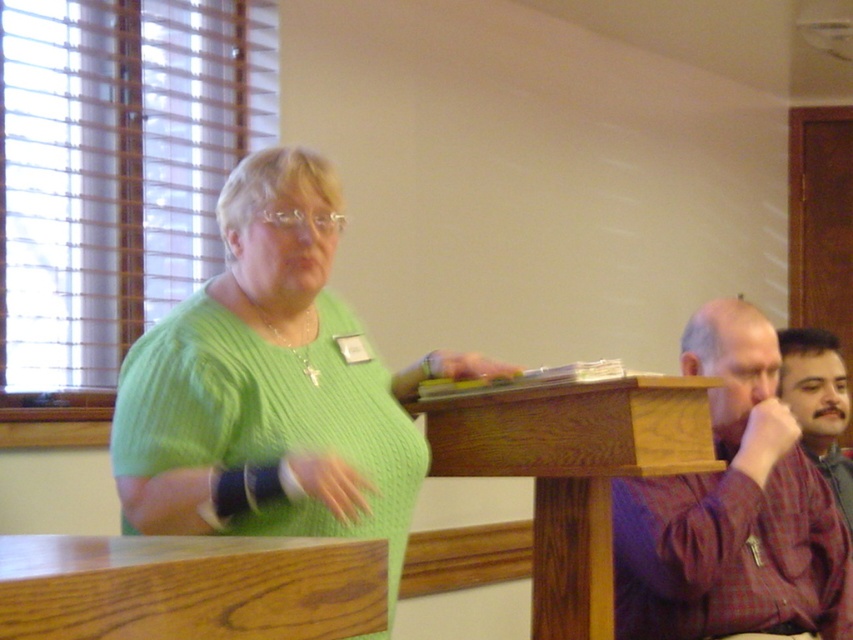
Which is above, green knitted sweater at center or wooden podium at center?

Positioned higher is green knitted sweater at center.

Who is positioned more to the right, green knitted sweater at center or wooden podium at center?

wooden podium at center

Which is behind, point (198, 499) or point (577, 554)?

Positioned behind is point (577, 554).

Find the location of `green knitted sweater at center`. green knitted sweater at center is located at coordinates (273, 387).

Between point (746, 348) and point (807, 410), which one is positioned in front?

Point (746, 348) is more forward.

Does point (845, 534) come farther from viewer compared to point (815, 376)?

No.

What do you see at coordinates (733, 509) in the screenshot?
I see `plaid shirt at right` at bounding box center [733, 509].

Identify the location of plaid shirt at right. This screenshot has height=640, width=853. (733, 509).

Can you confirm if wooden podium at center is positioned below brown plaid shirt at right?

No, wooden podium at center is not below brown plaid shirt at right.

Describe the element at coordinates (572, 472) in the screenshot. This screenshot has width=853, height=640. I see `wooden podium at center` at that location.

Is point (670, 458) positioned in front of point (834, 364)?

Yes, it is.

Identify the location of wooden podium at center. The height and width of the screenshot is (640, 853). (572, 472).